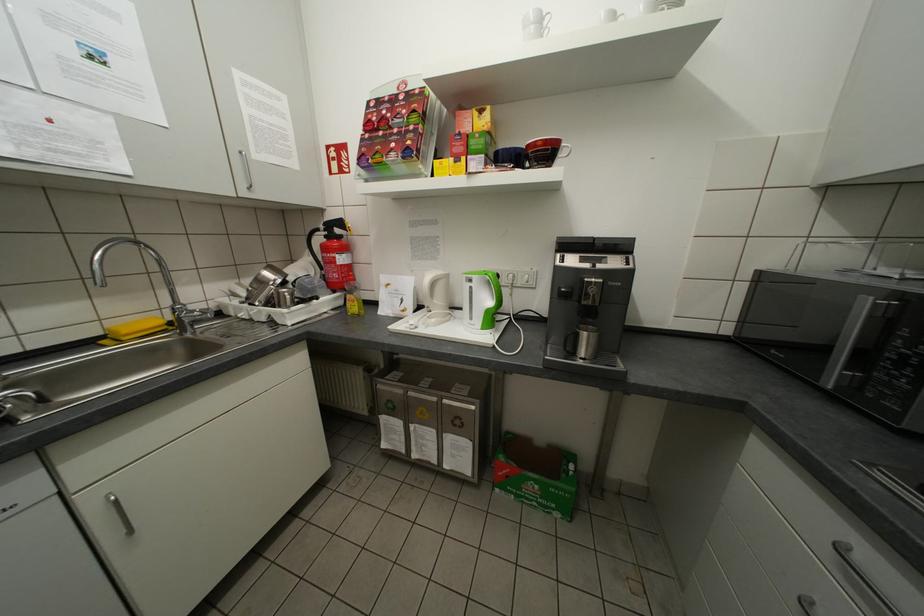
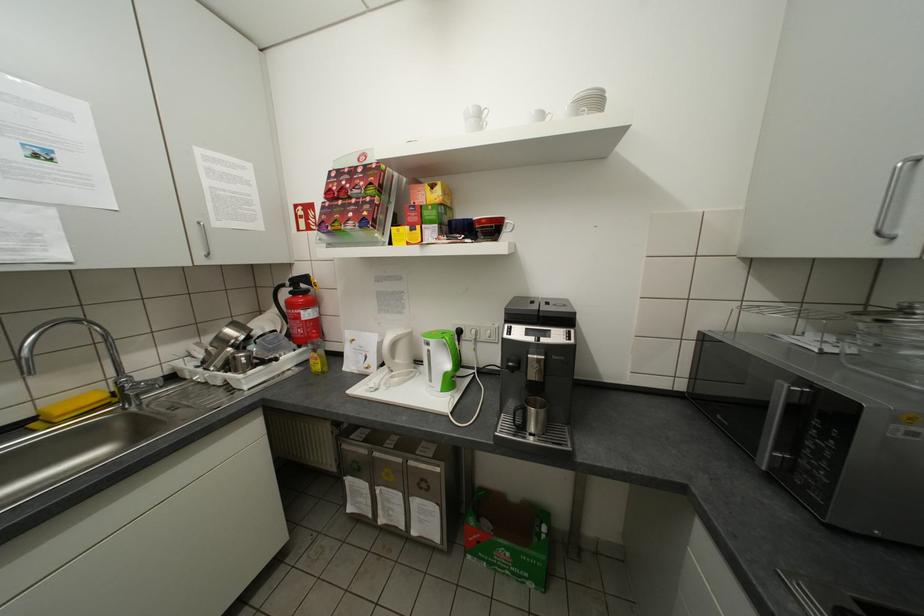
The point at (591, 353) is marked in the first image. Where is the corresponding point in the second image?

(541, 428)